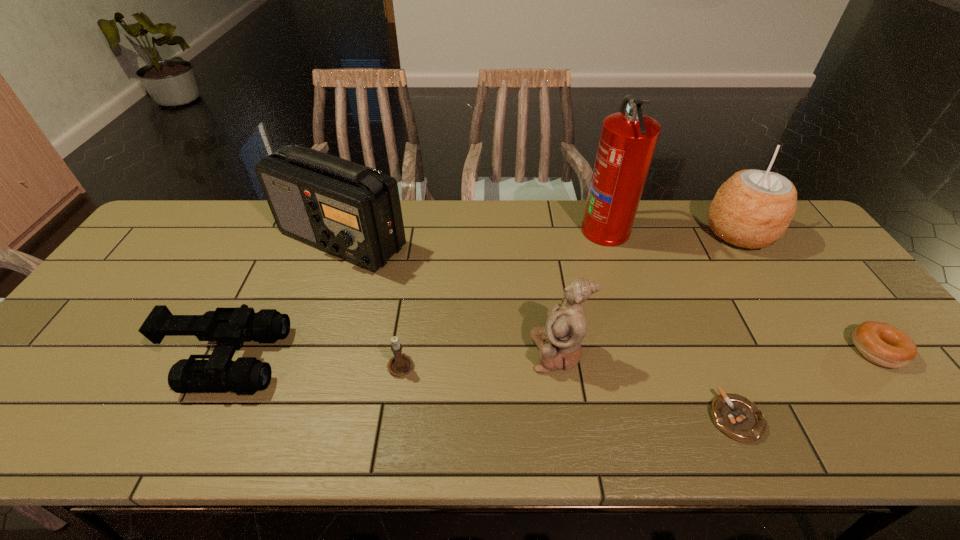
This screenshot has height=540, width=960. In order to click on the fourth object from right to left in this screenshot , I will do `click(628, 140)`.

I want to click on fire extinguisher, so click(x=628, y=140).

You are a GUI agent. You are given a task and a screenshot of the screen. Output one action in this format:
    pyautogui.click(x=<x>, y=<y>)
    Task: Click on the radio receiver
    This screenshot has height=540, width=960.
    Given the screenshot: What is the action you would take?
    pyautogui.click(x=352, y=211)

This screenshot has width=960, height=540. I want to click on coconut, so click(752, 209).

Find the location of a particular element. This screenshot has width=960, height=540. figurine is located at coordinates (559, 342).

Identify the location of binoculars. This screenshot has width=960, height=540. (230, 327).

At what (x,y) coordinates should I click in order to perform the action: click on the sixth tallest object. Please return your answer as a coordinate pair (x, y). This screenshot has height=540, width=960. Looking at the image, I should click on (401, 364).

Where is `candle holder`? This screenshot has width=960, height=540. candle holder is located at coordinates (401, 364).

Where is `bagel`? The image size is (960, 540). bagel is located at coordinates (882, 344).

Where is `the shortest object`? This screenshot has width=960, height=540. the shortest object is located at coordinates (736, 416).